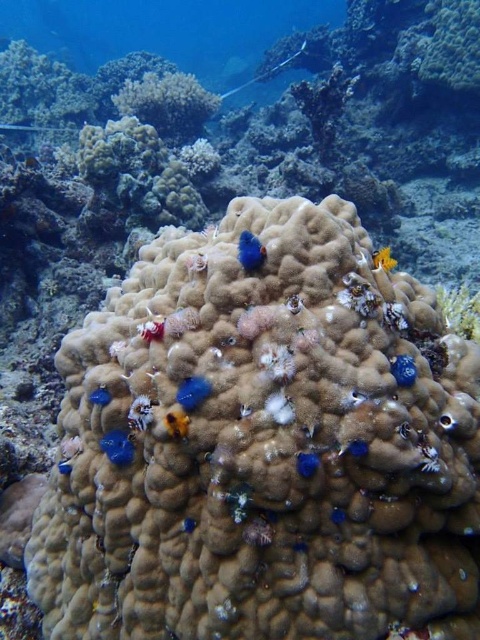
You are a scuba diver preparing to take a photo of the blue matte coral at center. Your camera has a minimum focusing distance of 35 inches. Will you need to move closer or farther away to ensure the coral is in focus?

The blue matte coral at center is 34.85 inches away from the viewer, which is just under the camera minimum focusing distance of 35 inches. Therefore, you need to move slightly farther away to ensure the coral is in focus.

You are a marine biologist observing this underwater scene. You notice two fish species here. The blue rubber fish at lower left and the smooth blue fish at center. Which of these two fish is bigger in size?

The blue rubber fish at lower left is larger in size than the smooth blue fish at center.

You are a marine biologist diving in the coral reef. You need to reach a specific point marked at coordinates point (x=252, y=234). Your diving equipment has a maximum reach of 30 inches. Can you safely reach this point without extending beyond your equipment limits?

The distance of point (x=252, y=234) from the camera is 35.88 inches, which exceeds your equipment limit of 30 inches. Therefore, you cannot safely reach this point without extending beyond your equipment limits.